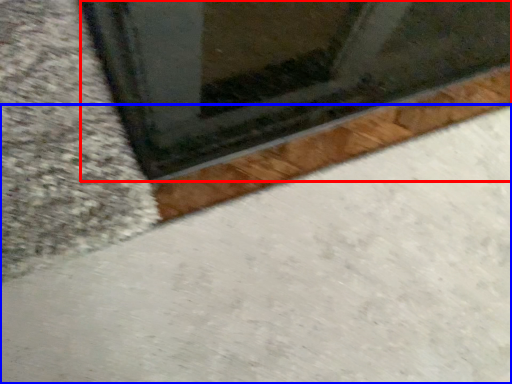
Question: Which of the following is the farthest to the observer, window (highlighted by a red box) or concrete (highlighted by a blue box)?

Choices:
 (A) window
 (B) concrete

Answer: (A)